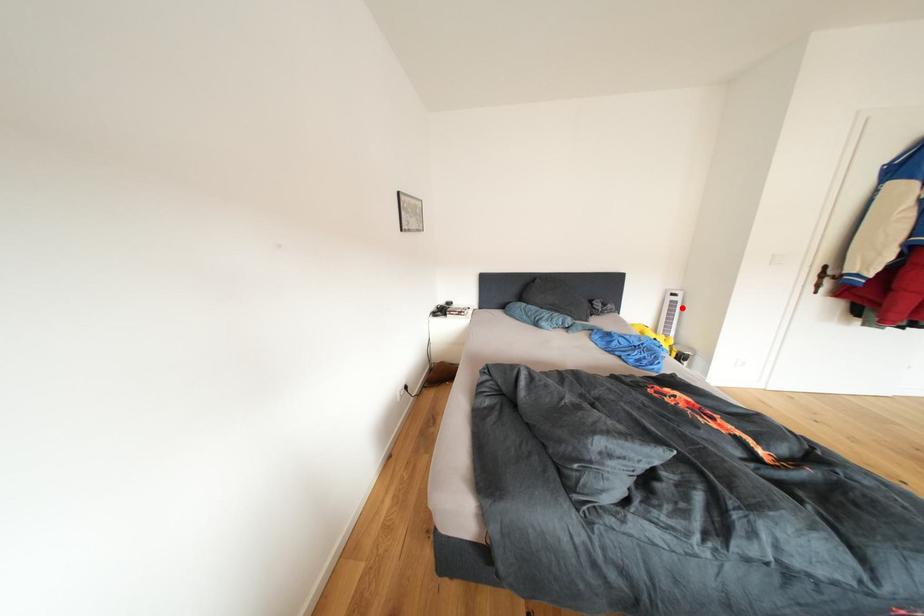
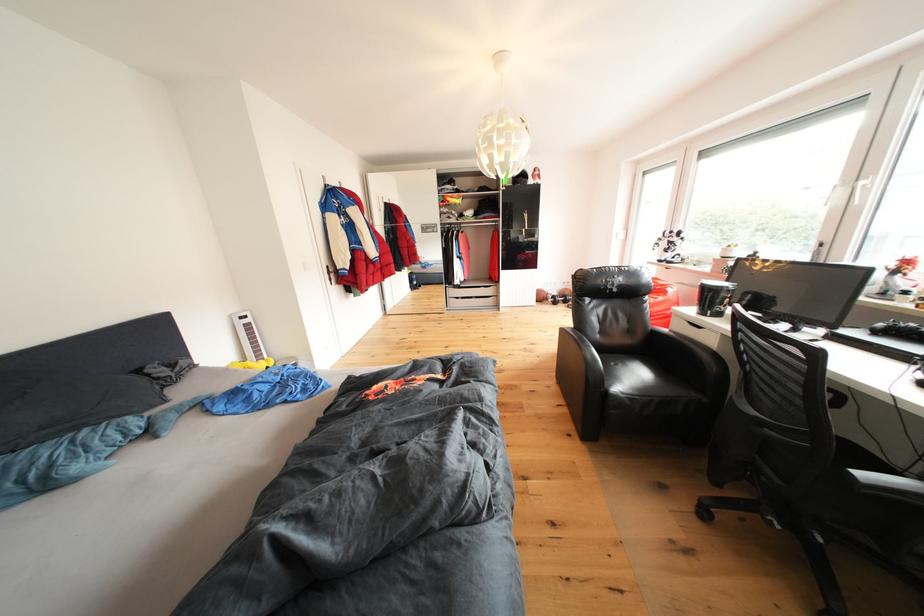
Locate, in the second image, the point that corresponds to the highlighted location in the first image.

(257, 331)